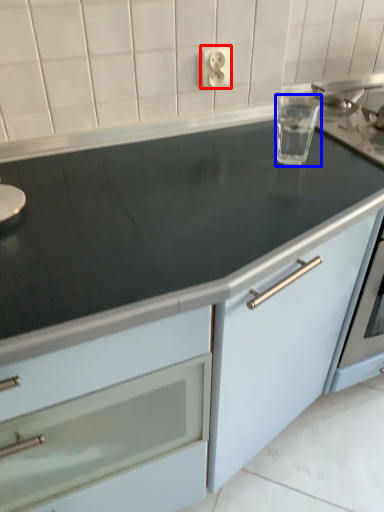
Question: Which point is further to the camera, electric outlet (highlighted by a red box) or appliance (highlighted by a blue box)?

Choices:
 (A) electric outlet
 (B) appliance

Answer: (A)